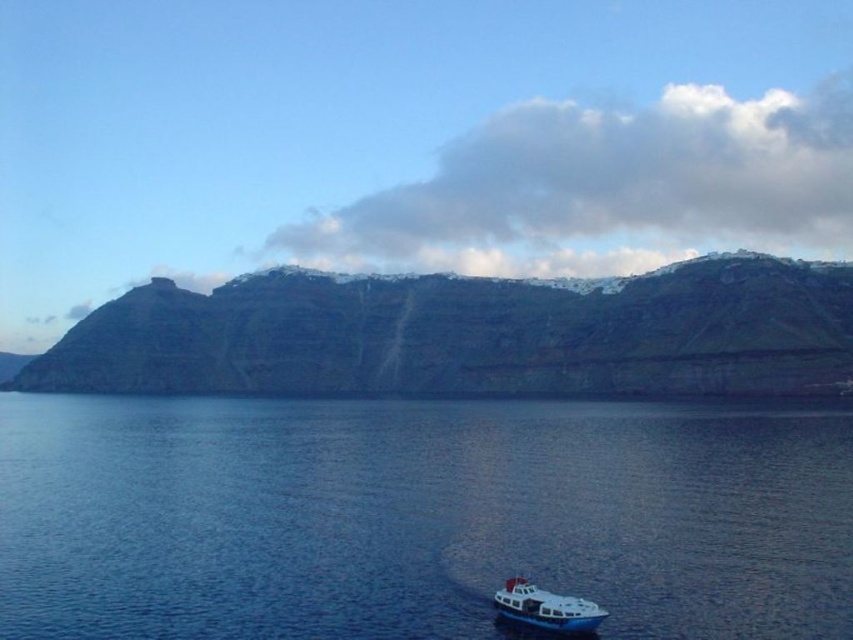
You are standing at the cliff edge looking out at the scene. A point marked at coordinates (418, 516) is visible. Based on the description, what does this point most likely represent in the image?

The point at (418, 516) corresponds to blue liquid water at lower center.

You are standing on the cliff and looking down at the blue liquid water at lower center and the white glossy boat at lower left. Which object is closer to your left side?

The white glossy boat at lower left is closer to your left side because the blue liquid water at lower center is to the left of it, meaning the boat is positioned to the right of the water from your perspective.